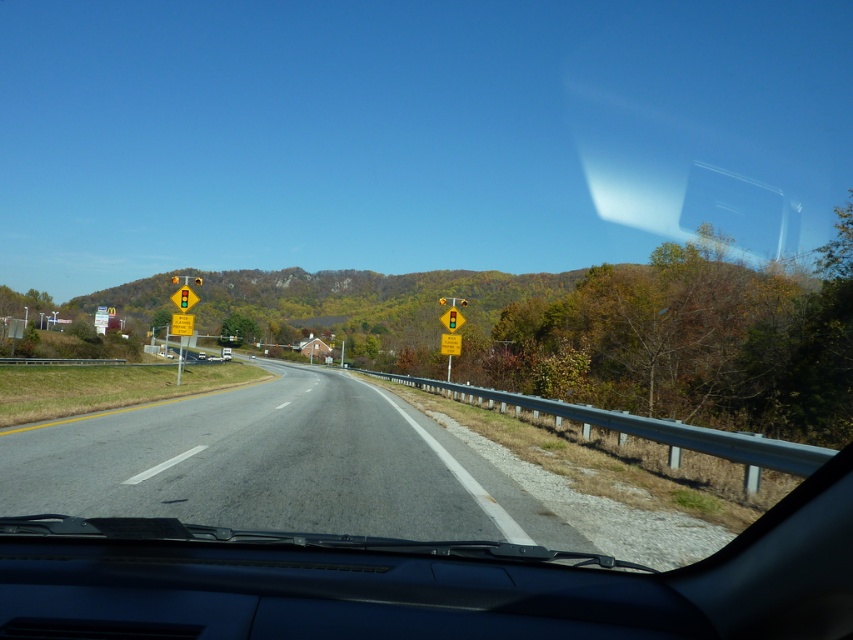
Is yellow reflective diamond at center taller than yellow plastic traffic light at center?

Incorrect, yellow reflective diamond at center's height is not larger of yellow plastic traffic light at center's.

Is yellow reflective diamond at center to the right of yellow plastic traffic light at center from the viewer's perspective?

No, yellow reflective diamond at center is not to the right of yellow plastic traffic light at center.

The image size is (853, 640). In order to click on yellow reflective diamond at center in this screenshot , I will do `click(181, 324)`.

Where is `yellow reflective diamond at center`? This screenshot has width=853, height=640. yellow reflective diamond at center is located at coordinates (181, 324).

From the picture: Is yellow reflective diamond at center positioned at the back of yellow plastic traffic sign at center?

Yes, it is behind yellow plastic traffic sign at center.

Does point (184, 314) come farther from viewer compared to point (456, 314)?

Yes, it is.

Locate an element on the screen. The height and width of the screenshot is (640, 853). yellow reflective diamond at center is located at coordinates click(181, 324).

In the scene shown: Who is taller, yellow plastic traffic sign at center or yellow plastic traffic light at center?

yellow plastic traffic light at center

Is yellow plastic traffic sign at center wider than yellow plastic traffic light at center?

Yes, yellow plastic traffic sign at center is wider than yellow plastic traffic light at center.

Is point (456, 323) less distant than point (187, 294)?

No.

The height and width of the screenshot is (640, 853). Identify the location of yellow plastic traffic sign at center. (451, 320).